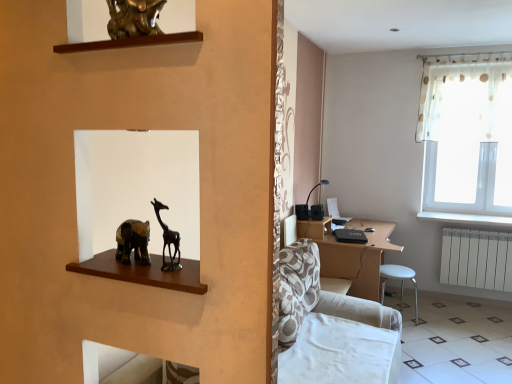
Question: Does white glossy tile at lower right have a larger size compared to matte black table lamp at center-right?

Choices:
 (A) yes
 (B) no

Answer: (A)

Question: From a real-world perspective, is white glossy tile at lower right physically above matte black table lamp at center-right?

Choices:
 (A) no
 (B) yes

Answer: (A)

Question: Considering the relative sizes of white glossy tile at lower right and matte black table lamp at center-right in the image provided, is white glossy tile at lower right thinner than matte black table lamp at center-right?

Choices:
 (A) yes
 (B) no

Answer: (B)

Question: Is white glossy tile at lower right not close to matte black table lamp at center-right?

Choices:
 (A) no
 (B) yes

Answer: (B)

Question: Is white glossy tile at lower right taller than matte black table lamp at center-right?

Choices:
 (A) no
 (B) yes

Answer: (A)

Question: In the image, is white plastic stool at lower right on the left side or the right side of matte black table lamp at center-right?

Choices:
 (A) left
 (B) right

Answer: (B)

Question: From the image's perspective, relative to matte black table lamp at center-right, is white plastic stool at lower right above or below?

Choices:
 (A) above
 (B) below

Answer: (B)

Question: Would you say white plastic stool at lower right is inside or outside matte black table lamp at center-right?

Choices:
 (A) inside
 (B) outside

Answer: (B)

Question: Is white plastic stool at lower right bigger or smaller than matte black table lamp at center-right?

Choices:
 (A) small
 (B) big

Answer: (B)

Question: From the image's perspective, is white glossy tile at lower right above or below white plastic radiator at lower right?

Choices:
 (A) above
 (B) below

Answer: (B)

Question: Does point (426, 297) appear closer or farther from the camera than point (466, 243)?

Choices:
 (A) farther
 (B) closer

Answer: (A)

Question: Is white glossy tile at lower right wider or thinner than white plastic radiator at lower right?

Choices:
 (A) thin
 (B) wide

Answer: (B)

Question: Is white glossy tile at lower right bigger or smaller than white plastic radiator at lower right?

Choices:
 (A) small
 (B) big

Answer: (B)

Question: Considering the positions of matte black table lamp at center-right and white plastic stool at lower right in the image, is matte black table lamp at center-right wider or thinner than white plastic stool at lower right?

Choices:
 (A) wide
 (B) thin

Answer: (B)

Question: Which is correct: matte black table lamp at center-right is inside white plastic stool at lower right, or outside of it?

Choices:
 (A) inside
 (B) outside

Answer: (B)